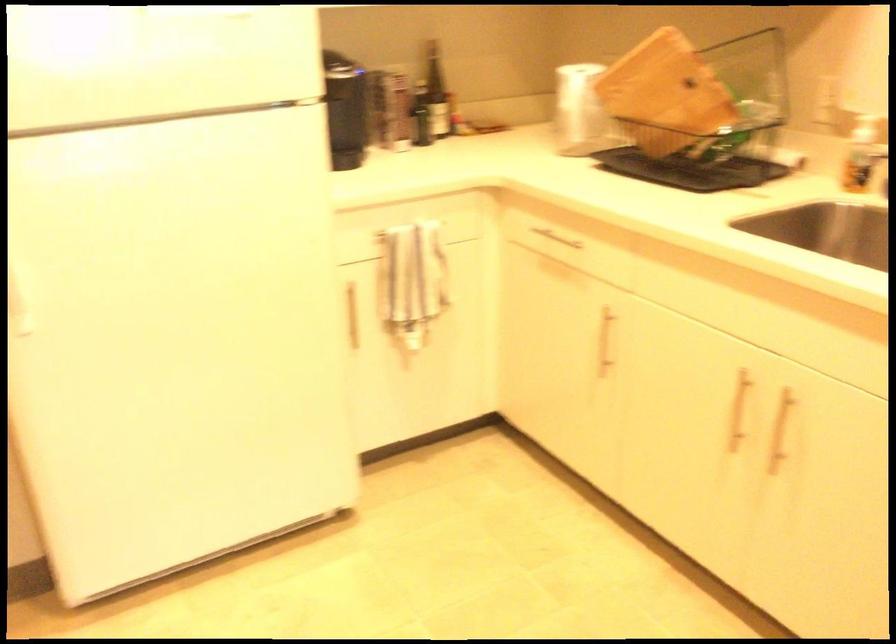
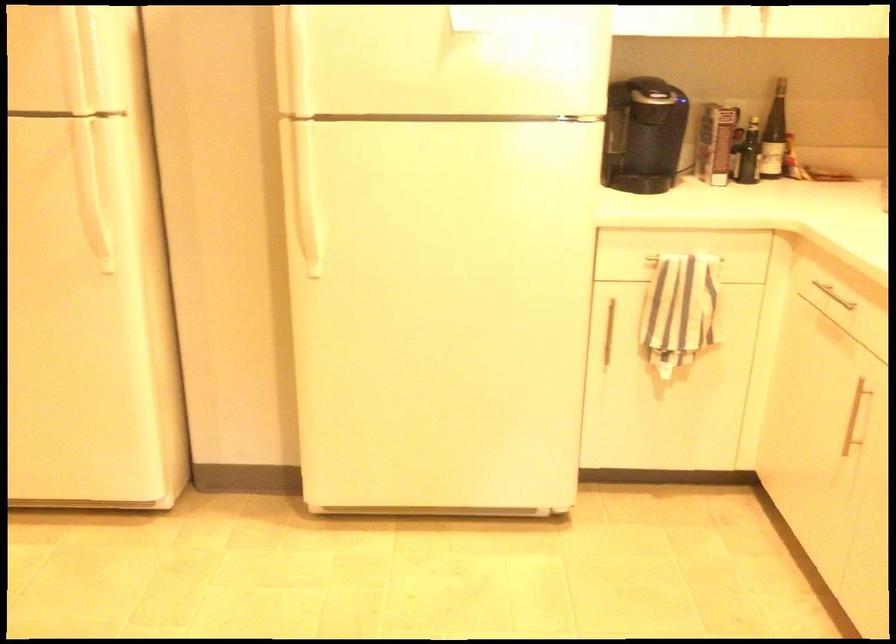
Question: How did the camera likely rotate?

Choices:
 (A) Left
 (B) Right
 (C) Up
 (D) Down

Answer: (A)